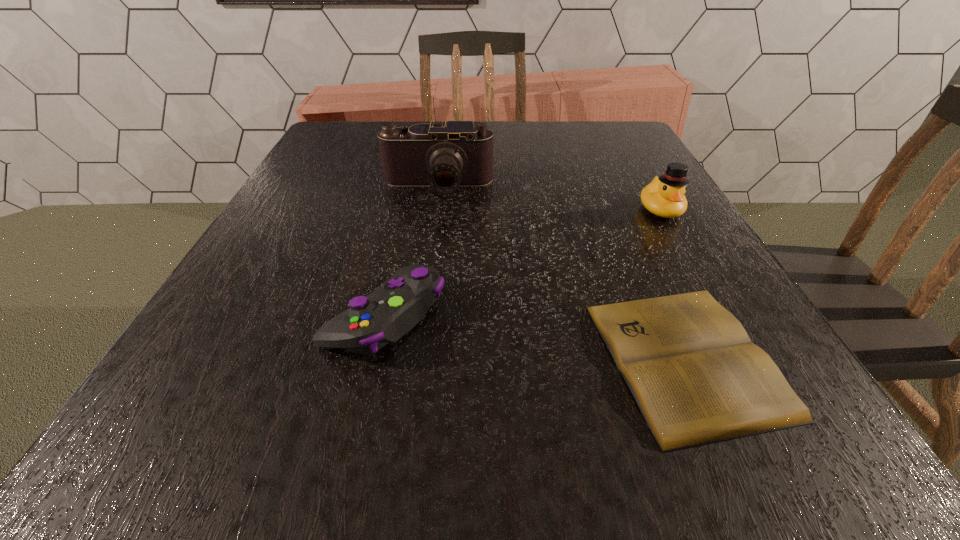
Locate an element on the screen. This screenshot has height=540, width=960. camera is located at coordinates (446, 155).

Identify the location of duck. Image resolution: width=960 pixels, height=540 pixels. (664, 196).

At what (x,y) coordinates should I click in order to perform the action: click on control. Please return your answer as a coordinate pair (x, y). The width and height of the screenshot is (960, 540). Looking at the image, I should click on (389, 312).

This screenshot has height=540, width=960. Find the location of `book`. book is located at coordinates (697, 378).

The image size is (960, 540). In order to click on vacant space located 0.080m on the front-facing side of the tallest object in this screenshot , I will do `click(432, 226)`.

This screenshot has width=960, height=540. Find the location of `vacant region located 0.250m on the front-facing side of the second tallest object`. vacant region located 0.250m on the front-facing side of the second tallest object is located at coordinates (726, 324).

Image resolution: width=960 pixels, height=540 pixels. I want to click on free space located 0.290m on the right of the third tallest object, so click(x=638, y=316).

Locate an element on the screen. The width and height of the screenshot is (960, 540). free region located on the left of the book is located at coordinates (334, 358).

Image resolution: width=960 pixels, height=540 pixels. I want to click on object at the near edge, so click(697, 378).

I want to click on duck at the right edge, so click(x=664, y=196).